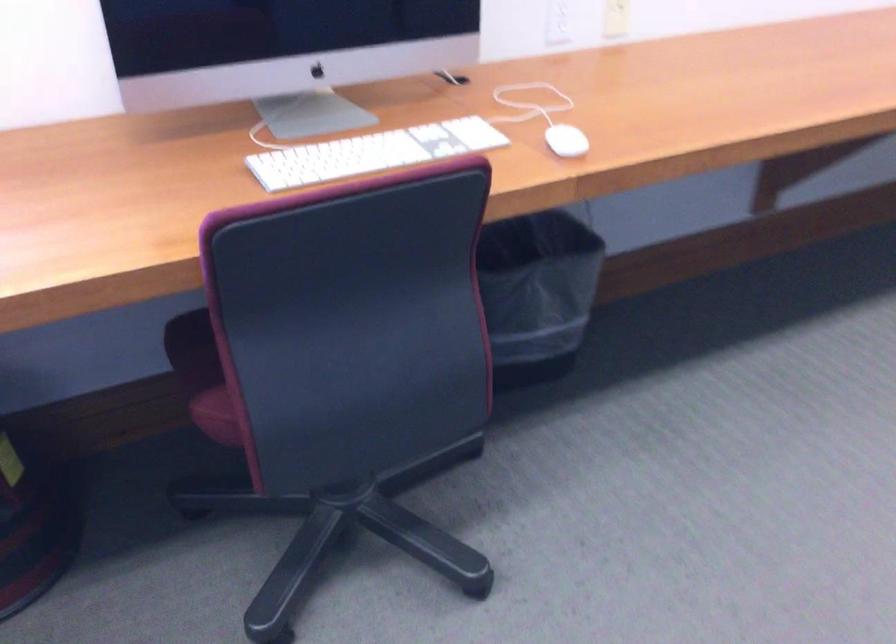
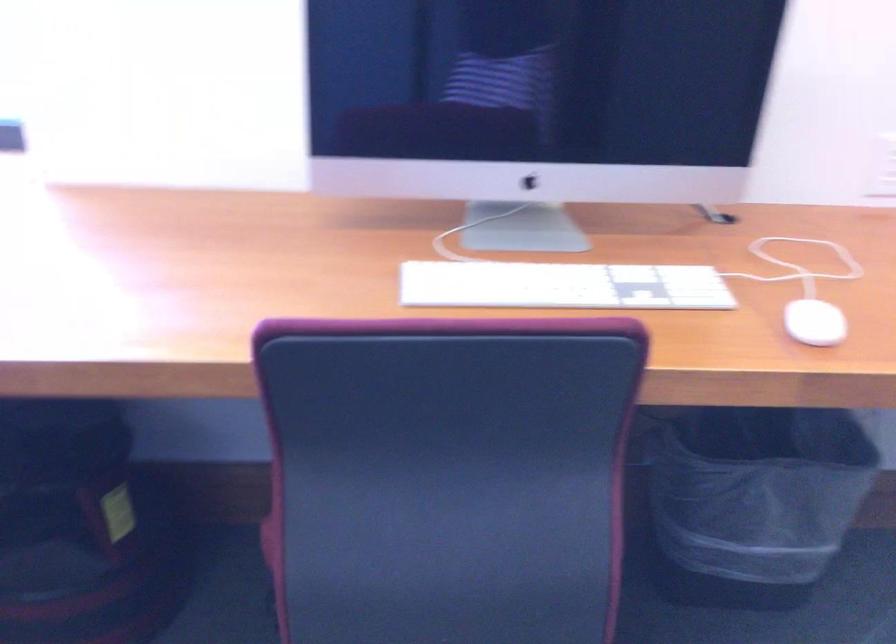
Find the pixel in the second image that matches point (572, 140) in the first image.

(814, 323)